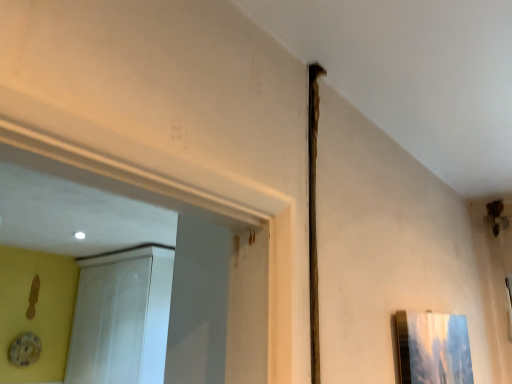
Measure the distance between white glossy screen door at upper left and camera.

white glossy screen door at upper left and camera are 8.47 feet apart.

At what (x,y) coordinates should I click in order to perform the action: click on white glossy screen door at upper left. Please return your answer as a coordinate pair (x, y). The width and height of the screenshot is (512, 384). Looking at the image, I should click on (109, 323).

Describe the element at coordinates (109, 323) in the screenshot. I see `white glossy screen door at upper left` at that location.

Find the location of a particular element. white glossy screen door at upper left is located at coordinates (109, 323).